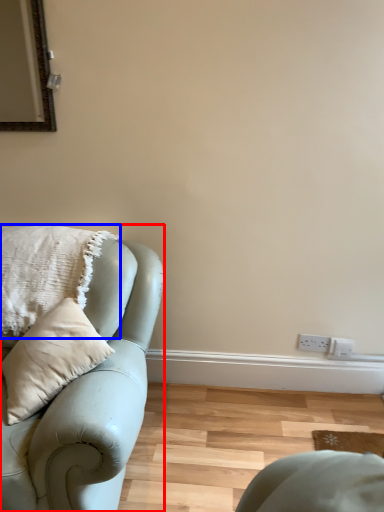
Question: Among these objects, which one is nearest to the camera, studio couch (highlighted by a red box) or pillow (highlighted by a blue box)?

Choices:
 (A) studio couch
 (B) pillow

Answer: (A)